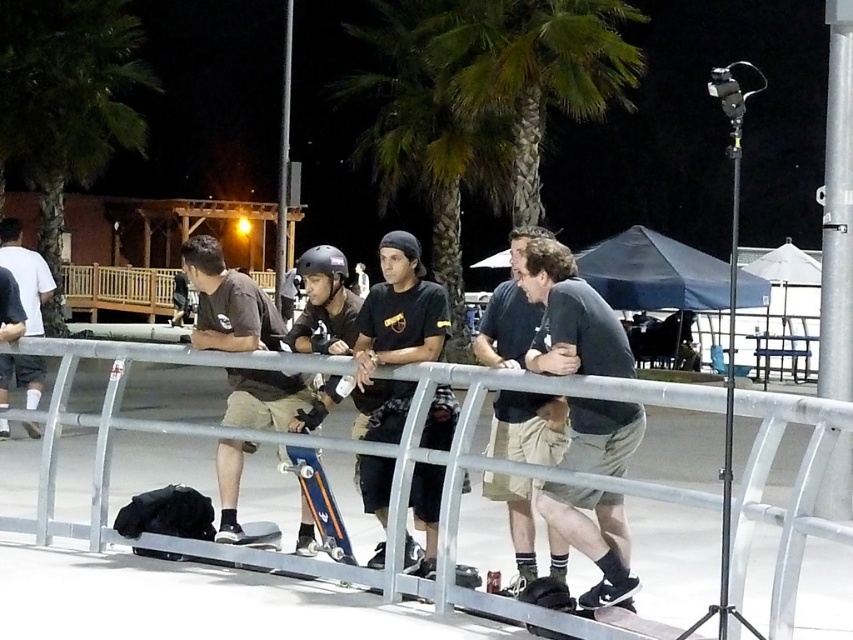
Does green leafy palm tree at upper left appear over blue metallic skateboard at center?

Yes, green leafy palm tree at upper left is above blue metallic skateboard at center.

Is point (41, 131) farther from viewer compared to point (289, 461)?

That is True.

Identify the location of green leafy palm tree at upper left. (67, 97).

Can you confirm if matte black skateboard at left is wider than blue metallic skateboard at center?

Indeed, matte black skateboard at left has a greater width compared to blue metallic skateboard at center.

Is point (10, 355) farther from camera compared to point (318, 472)?

Yes, it is behind point (318, 472).

What are the coordinates of `matte black skateboard at left` in the screenshot? It's located at (25, 273).

In order to click on green leafy palm tree at upper center in this screenshot , I will do `click(531, 68)`.

In the scene shown: Does green leafy palm tree at upper center come in front of black matte t-shirt at center?

No, it is not.

I want to click on green leafy palm tree at upper center, so click(531, 68).